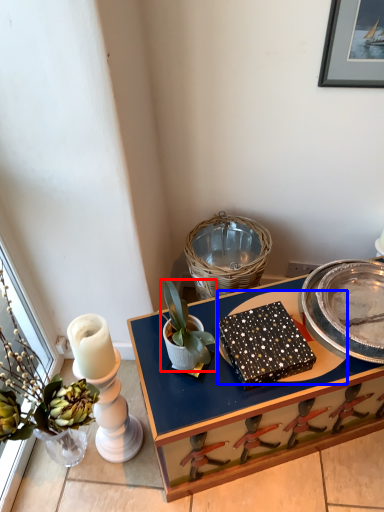
Question: Among these objects, which one is farthest to the camera, houseplant (highlighted by a red box) or glass plate (highlighted by a blue box)?

Choices:
 (A) houseplant
 (B) glass plate

Answer: (B)